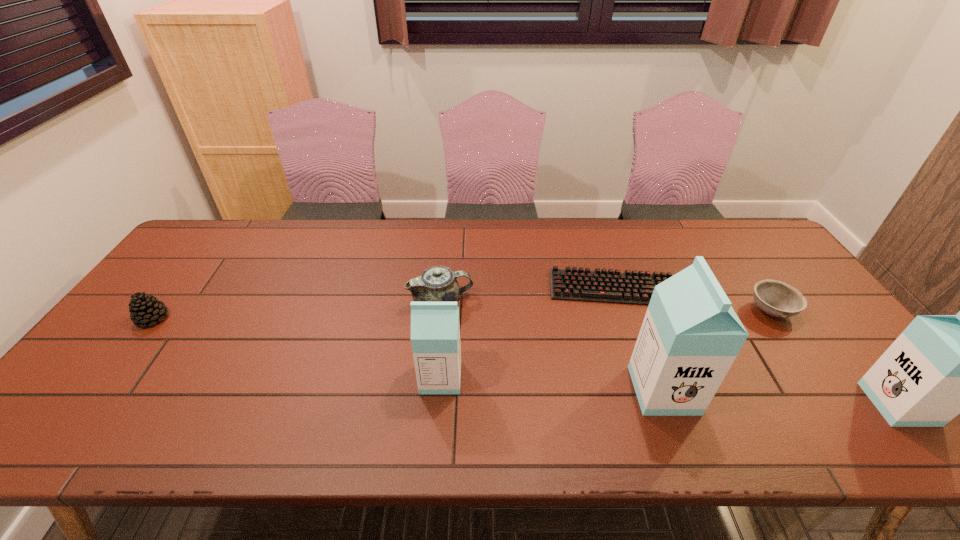
Point out which milk carton is positioned as the nearest to the third shortest object. Please provide its 2D coordinates. Your answer should be formatted as a tuple, i.e. [(x, y)], where the tuple contains the x and y coordinates of a point satisfying the conditions above.

[(435, 329)]

Identify which milk carton is the second nearest to the computer keyboard. Please provide its 2D coordinates. Your answer should be formatted as a tuple, i.e. [(x, y)], where the tuple contains the x and y coordinates of a point satisfying the conditions above.

[(435, 329)]

This screenshot has width=960, height=540. Identify the location of vacant space that satisfies the following two spatial constraints: 1. from the spout of the leftmost milk carton; 2. on the right side of the chinaware. (434, 377).

The image size is (960, 540). I want to click on free region that satisfies the following two spatial constraints: 1. on the back side of the rightmost milk carton; 2. from the spout of the chinaware, so click(x=815, y=301).

The image size is (960, 540). What are the coordinates of `free spot that satisfies the following two spatial constraints: 1. on the front side of the computer keyboard; 2. on the right side of the bowl` in the screenshot? It's located at (621, 312).

Find the location of a particular element. blank space that satisfies the following two spatial constraints: 1. from the spout of the second milk carton from left to right; 2. on the left side of the chinaware is located at coordinates (433, 390).

At what (x,y) coordinates should I click in order to perform the action: click on free space that satisfies the following two spatial constraints: 1. from the spout of the second object from right to left; 2. on the right side of the chinaware. Please return your answer as a coordinate pair (x, y). Image resolution: width=960 pixels, height=540 pixels. Looking at the image, I should click on (441, 312).

I want to click on free location that satisfies the following two spatial constraints: 1. on the front side of the shortest object; 2. on the right side of the rightmost milk carton, so click(652, 404).